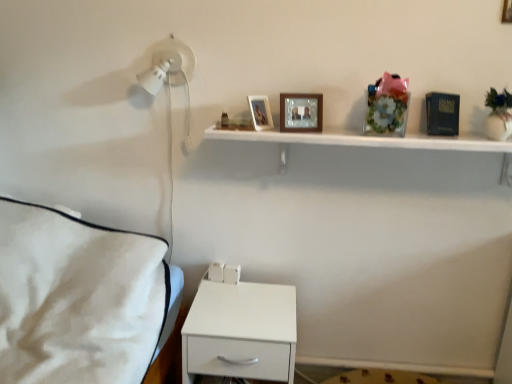
Question: From the image's perspective, is wooden picture frame at upper center, the 2th picture frame positioned from the left, above or below white matte nightstand at lower center?

Choices:
 (A) above
 (B) below

Answer: (A)

Question: Based on their sizes in the image, would you say wooden picture frame at upper center, the 2th picture frame positioned from the left, is bigger or smaller than white matte nightstand at lower center?

Choices:
 (A) big
 (B) small

Answer: (B)

Question: Which of these objects is positioned farthest from the white glossy shelf at upper center?

Choices:
 (A) wooden picture frame at upper center, which is the first picture frame from top to bottom
 (B) matte wooden picture frame at upper center, positioned as the 2th picture frame in bottom-to-top order
 (C) white matte nightstand at lower center
 (D) wooden picture frame at upper center, which ranks as the first picture frame in bottom-to-top order

Answer: (A)

Question: Which object is positioned farthest from the white matte nightstand at lower center?

Choices:
 (A) matte wooden picture frame at upper center, acting as the 1th picture frame starting from the left
 (B) wooden picture frame at upper center, positioned as the third picture frame in left-to-right order
 (C) white glossy shelf at upper center
 (D) wooden picture frame at upper center, which ranks as the first picture frame in bottom-to-top order

Answer: (B)